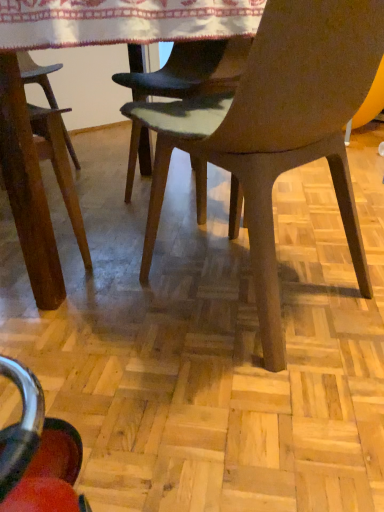
At what (x,y) coordinates should I click in order to perform the action: click on vacant space underneath matte brown chair at center (from a real-world perspective). Please return your answer as a coordinate pair (x, y). Looking at the image, I should click on (277, 288).